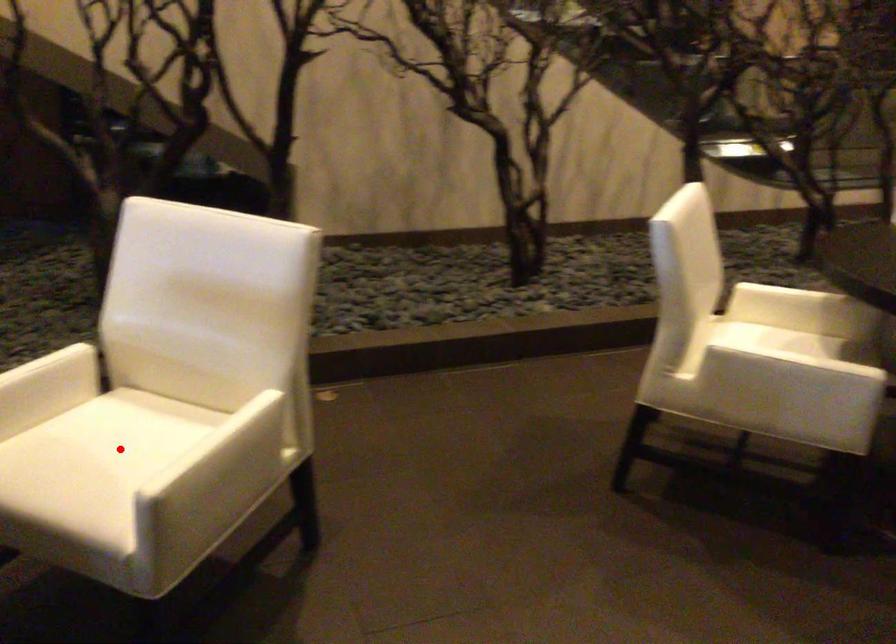
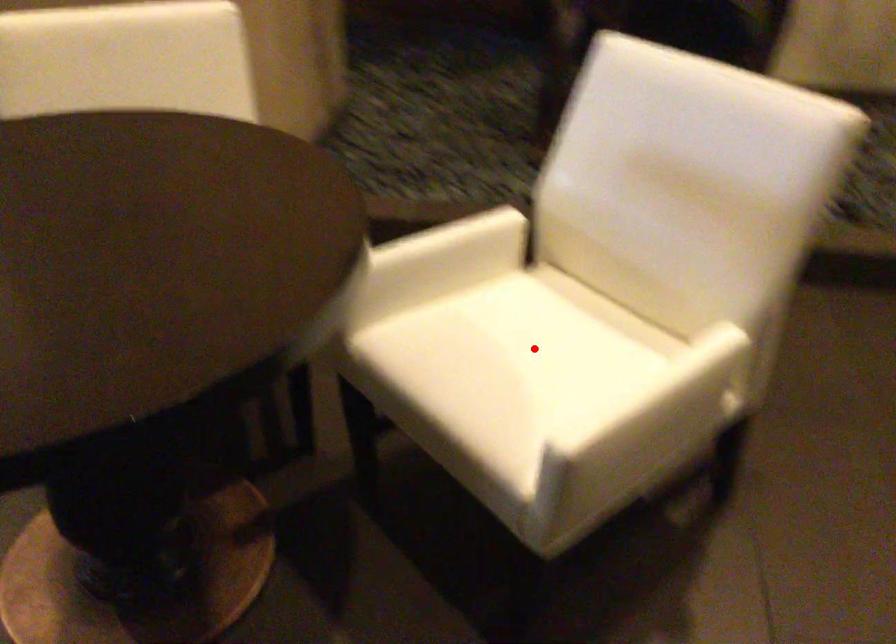
I am providing you with two images of the same scene from different viewpoints. A red point is marked on the first image and another point is marked on the second image. Is the marked point in image1 the same physical position as the marked point in image2?

Yes